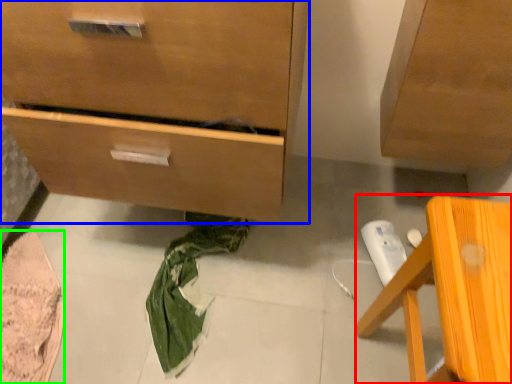
Question: Which object is the farthest from furniture (highlighted by a red box)? Choose among these: chest of drawers (highlighted by a blue box) or material (highlighted by a green box).

Choices:
 (A) chest of drawers
 (B) material

Answer: (B)